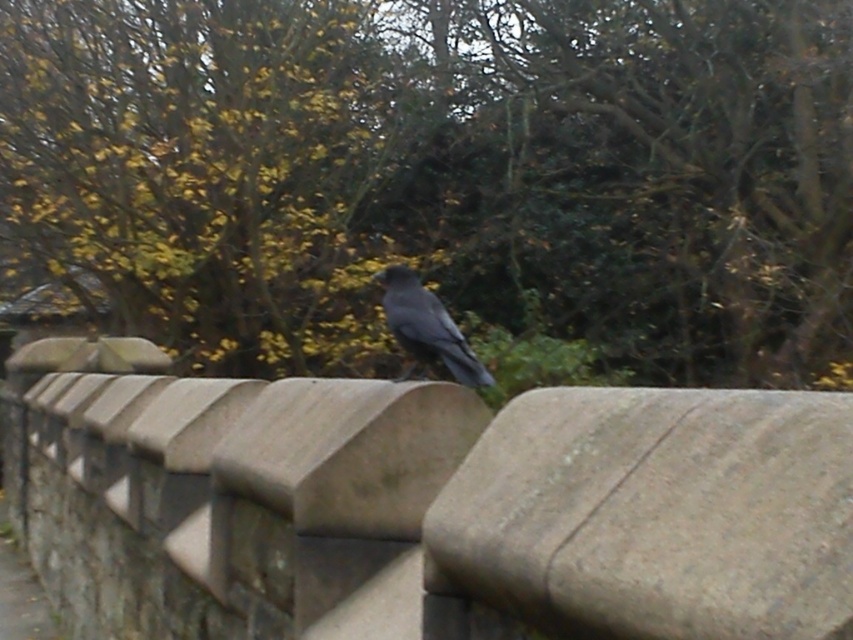
Can you confirm if green leafy tree at upper center is positioned above gray stone wall at center?

Yes, green leafy tree at upper center is above gray stone wall at center.

Is green leafy tree at upper center bigger than gray stone wall at center?

Actually, green leafy tree at upper center might be smaller than gray stone wall at center.

Measure the distance between point [791,376] and camera.

Point [791,376] and camera are 7.11 meters apart.

This screenshot has height=640, width=853. I want to click on green leafy tree at upper center, so click(439, 180).

Does green leafy tree at upper center have a greater width compared to shiny black bird at center?

Yes, green leafy tree at upper center is wider than shiny black bird at center.

Based on the photo, is green leafy tree at upper center above shiny black bird at center?

Yes, green leafy tree at upper center is above shiny black bird at center.

Locate an element on the screen. This screenshot has width=853, height=640. green leafy tree at upper center is located at coordinates (439, 180).

Can you confirm if gray stone wall at center is positioned to the right of shiny black bird at center?

Indeed, gray stone wall at center is positioned on the right side of shiny black bird at center.

Which is behind, point (798, 525) or point (405, 316)?

Positioned behind is point (405, 316).

I want to click on gray stone wall at center, so click(650, 516).